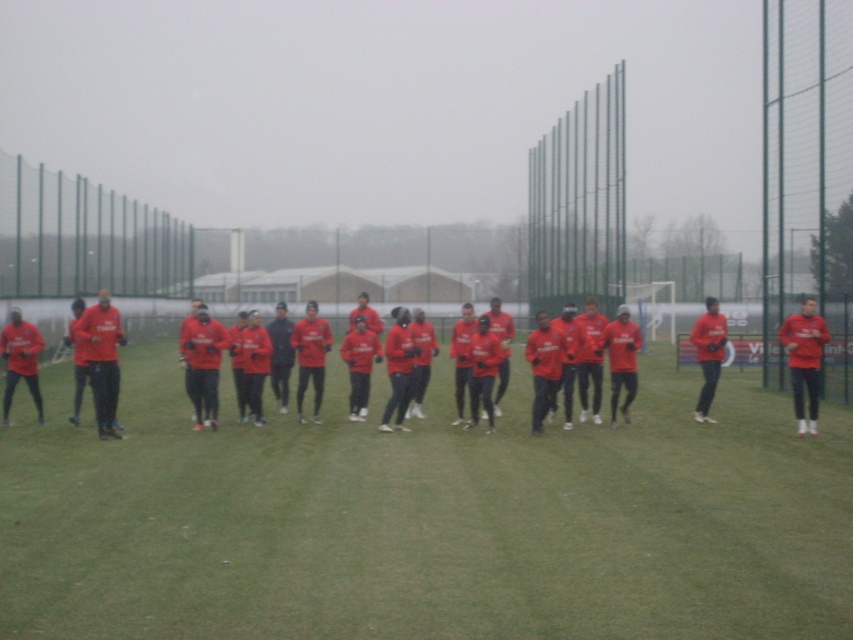
Does matte red shirts at center appear over red matte jersey at center?

Incorrect, matte red shirts at center is not positioned above red matte jersey at center.

Can you confirm if matte red shirts at center is bigger than red matte jersey at center?

No, matte red shirts at center is not bigger than red matte jersey at center.

Image resolution: width=853 pixels, height=640 pixels. Describe the element at coordinates (426, 518) in the screenshot. I see `matte red shirts at center` at that location.

This screenshot has height=640, width=853. Find the location of `matte red shirts at center`. matte red shirts at center is located at coordinates (426, 518).